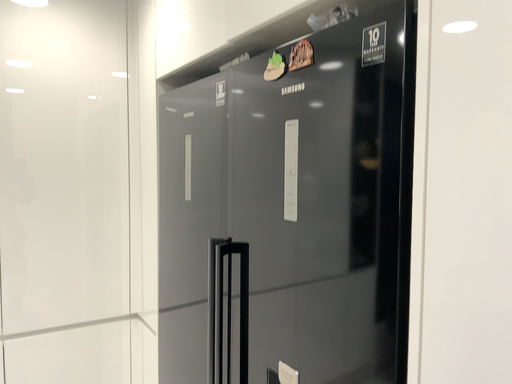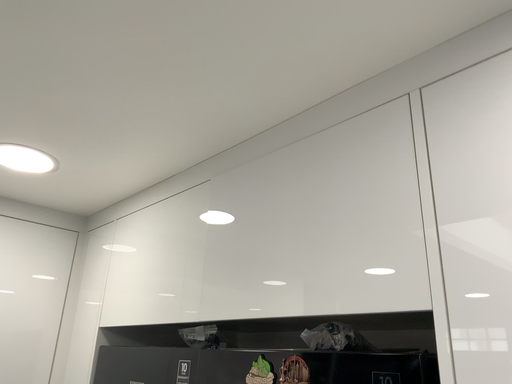
Question: Which way did the camera rotate in the video?

Choices:
 (A) rotated left
 (B) rotated right

Answer: (B)